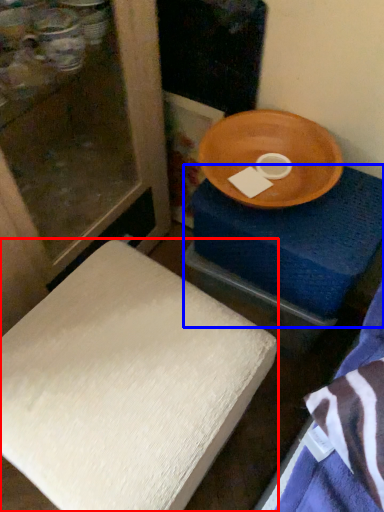
Question: Which object is further to the camera taking this photo, furniture (highlighted by a red box) or changing table (highlighted by a blue box)?

Choices:
 (A) furniture
 (B) changing table

Answer: (B)